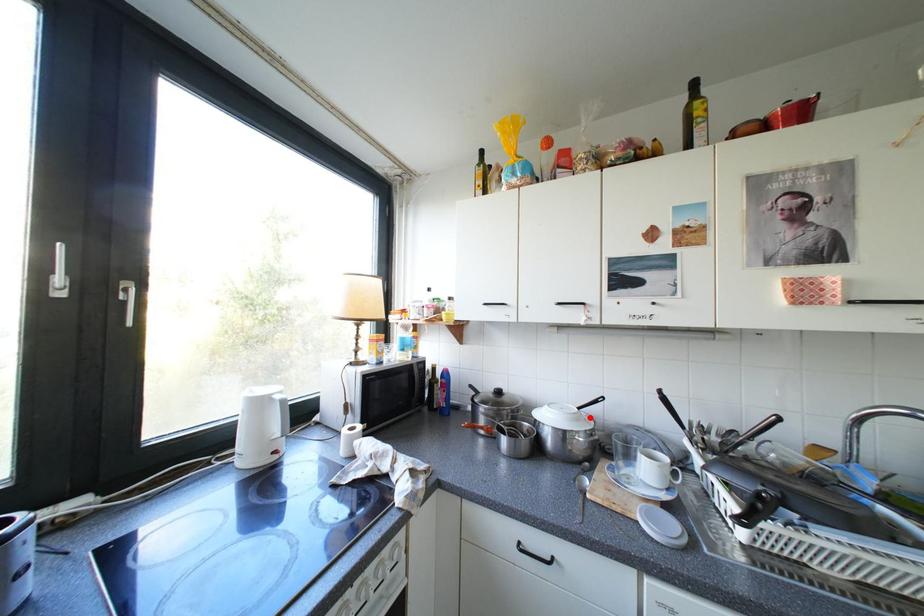
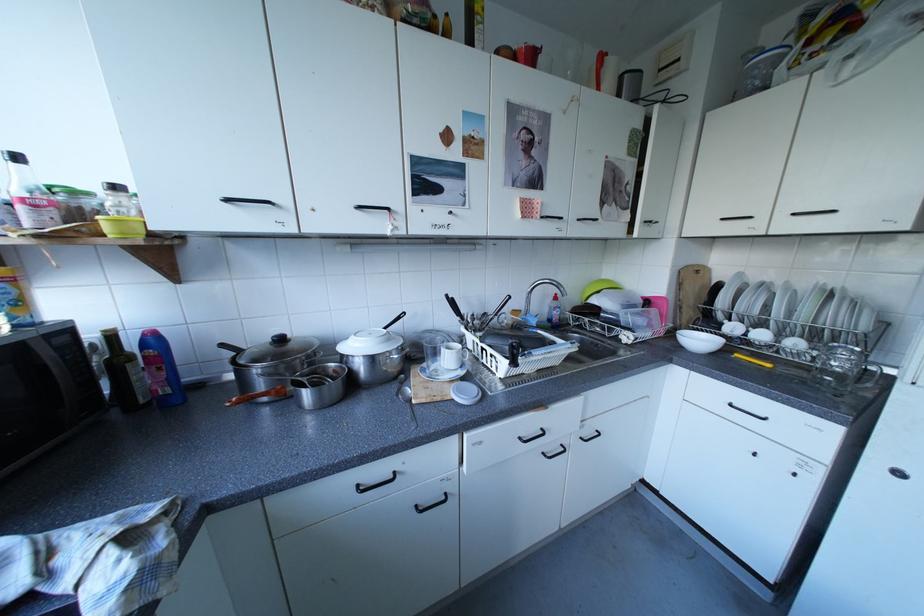
Question: I am providing you with two images of the same scene from different viewpoints. In image1, a red point is highlighted. Considering the same 3D point in image2, which of the following is correct?

Choices:
 (A) It is closer
 (B) It is farther

Answer: (A)